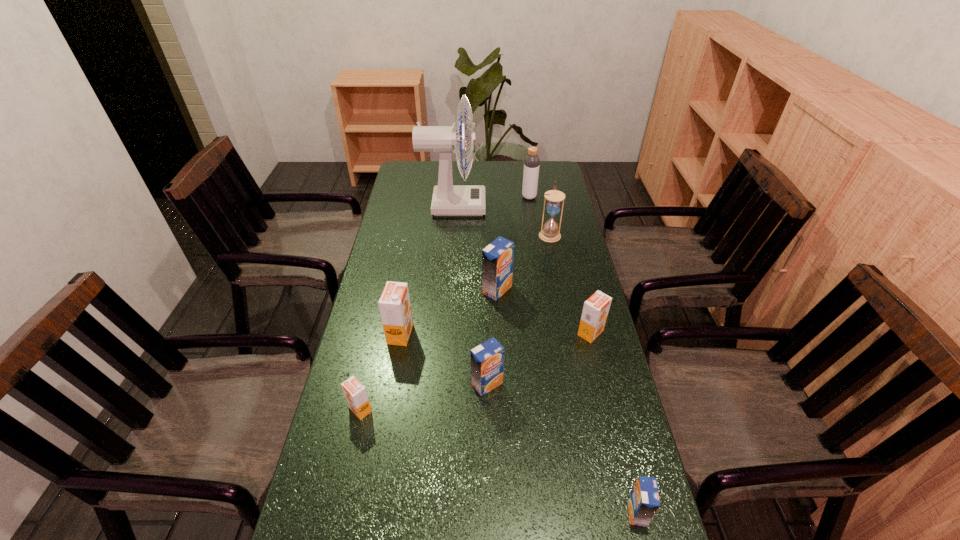
The height and width of the screenshot is (540, 960). Identify the location of vacant position in the image that satisfies the following two spatial constraints: 1. on the front-facing side of the rightmost orange orange juice; 2. on the right side of the tallest object. (443, 333).

The height and width of the screenshot is (540, 960). I want to click on vacant space that satisfies the following two spatial constraints: 1. on the front-facing side of the fan; 2. on the right side of the second farthest blue orange_juice, so click(x=439, y=384).

The image size is (960, 540). I want to click on vacant region that satisfies the following two spatial constraints: 1. on the front-facing side of the tallest object; 2. on the front side of the fifth orange juice from right to left, so pos(443,334).

Where is `vacant space that satisfies the following two spatial constraints: 1. on the front side of the rightmost orange orange juice; 2. on the right side of the white hourglass`? The width and height of the screenshot is (960, 540). vacant space that satisfies the following two spatial constraints: 1. on the front side of the rightmost orange orange juice; 2. on the right side of the white hourglass is located at coordinates (569, 333).

Image resolution: width=960 pixels, height=540 pixels. I want to click on free space that satisfies the following two spatial constraints: 1. on the back side of the second orange orange juice from right to left; 2. on the right side of the white hourglass, so click(418, 234).

Locate an element on the screen. blank space that satisfies the following two spatial constraints: 1. on the back side of the second orange orange juice from left to right; 2. on the left side of the biggest blue orange_juice is located at coordinates (408, 290).

Identify the location of vacant space that satisfies the following two spatial constraints: 1. on the front-facing side of the tallest object; 2. on the front side of the leftmost object. (437, 409).